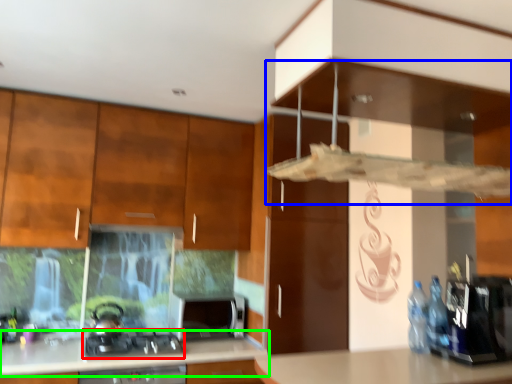
Question: Which is farther away from gas stove (highlighted by a red box)? vent (highlighted by a blue box) or countertop (highlighted by a green box)?

Choices:
 (A) vent
 (B) countertop

Answer: (A)